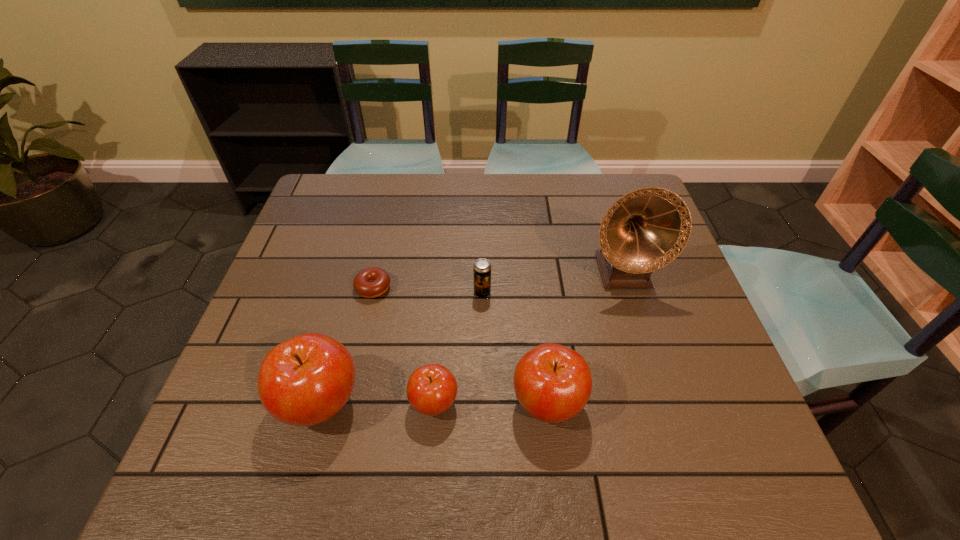
Locate an element on the screen. The height and width of the screenshot is (540, 960). the leftmost apple is located at coordinates (304, 381).

The image size is (960, 540). I want to click on the third object from left to right, so click(431, 389).

Identify the location of the shortest apple. The height and width of the screenshot is (540, 960). (431, 389).

This screenshot has height=540, width=960. In order to click on the second tallest apple in this screenshot , I will do `click(553, 383)`.

I want to click on the second object from right to left, so click(x=553, y=383).

Identify the location of the tallest object. (646, 229).

I want to click on phonograph record, so click(646, 229).

Locate an element on the screen. the shortest object is located at coordinates (372, 282).

You are a GUI agent. You are given a task and a screenshot of the screen. Output one action in this format:
    pyautogui.click(x=<x>, y=<y>)
    Task: Click on the fourth object from left to right
    
    Given the screenshot: What is the action you would take?
    pyautogui.click(x=482, y=268)

Identify the location of free space located 0.050m on the left of the leftmost apple. The width and height of the screenshot is (960, 540). (254, 402).